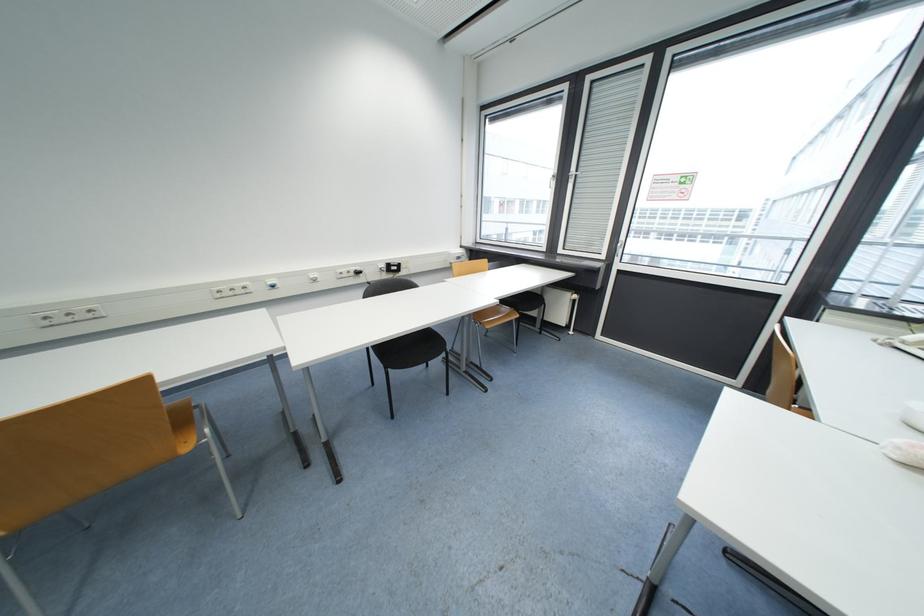
Describe the element at coordinates (494, 315) in the screenshot. I see `a brown chair sitting surface` at that location.